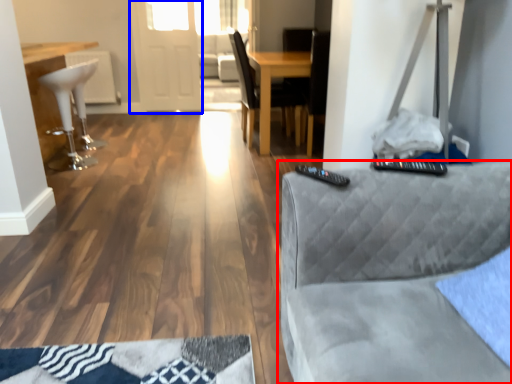
Question: Which object appears closest to the camera in this image, studio couch (highlighted by a red box) or glass door (highlighted by a blue box)?

Choices:
 (A) studio couch
 (B) glass door

Answer: (A)